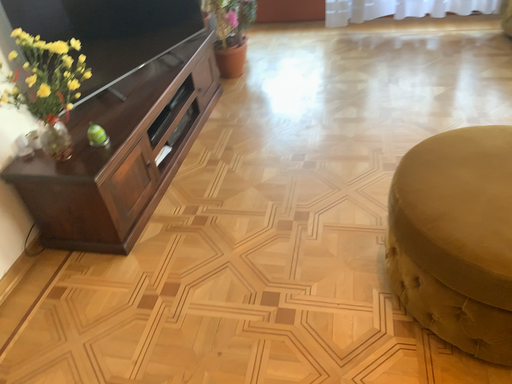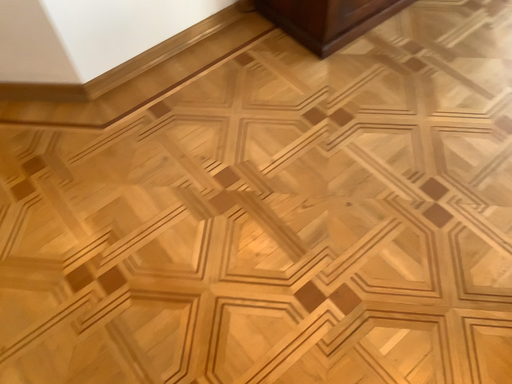
Question: Which way did the camera rotate in the video?

Choices:
 (A) rotated right
 (B) rotated left

Answer: (B)